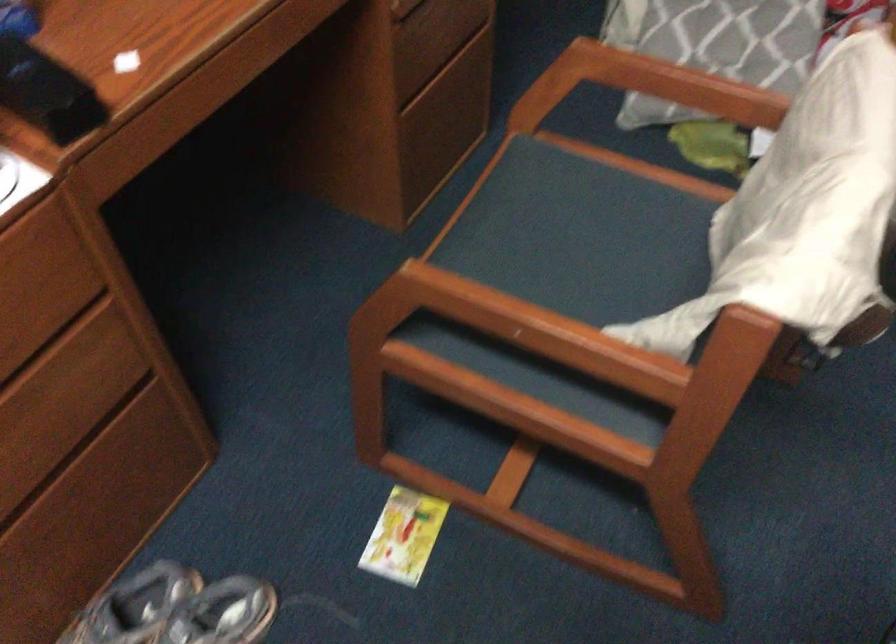
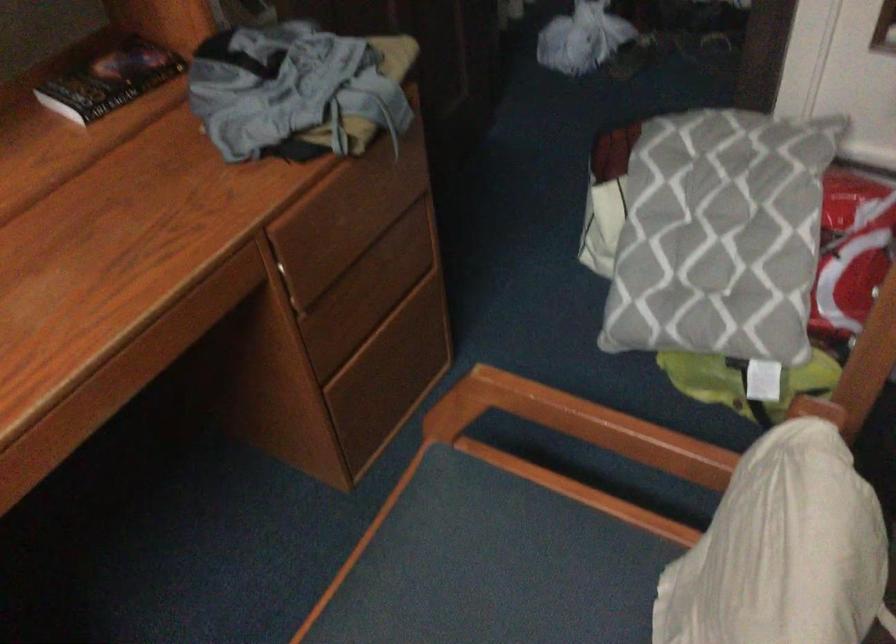
Locate, in the second image, the point that corresponds to [657,84] in the first image.

(579, 424)